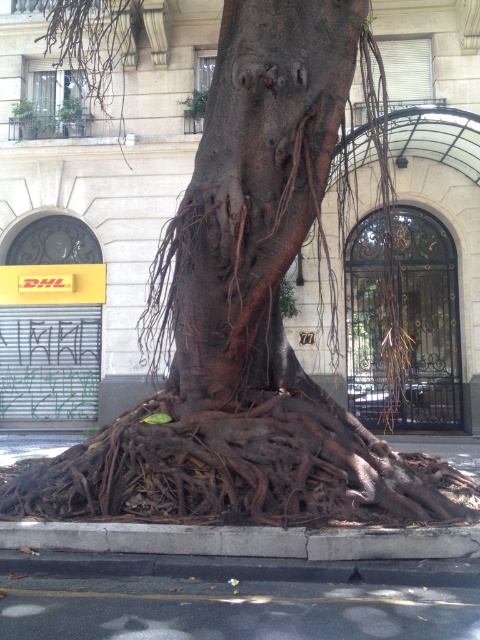
Looking at this image, you are a delivery person trying to walk through the sidewalk near the tree. The brown rough bark at center and the brown rough roots at lower center are in your path. Which part of the tree has a wider base that might block your path?

The brown rough roots at lower center have a greater width compared to the brown rough bark at center, so they might block your path more significantly.

You are a delivery person trying to navigate around the brown rough bark at center and the gray concrete curb at lower center. Which object has a narrower width?

The brown rough bark at center is thinner than the gray concrete curb at lower center, so the brown rough bark at center has a narrower width.

You are a delivery person trying to walk from the sidewalk to the DHL office. You see the brown rough roots at lower center and the black asphalt at lower center. Which surface should you avoid stepping on to reach the office safely?

You should avoid stepping on the brown rough roots at lower center because they are positioned over the black asphalt at lower center, making the roots an obstacle in your path.